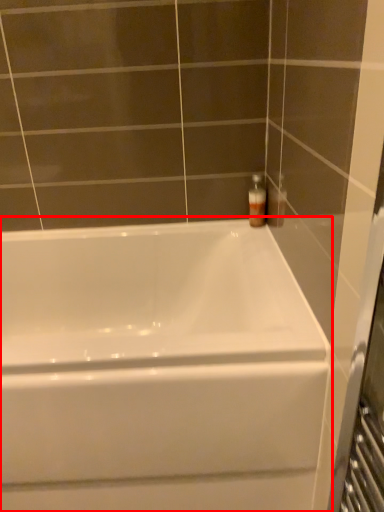
Question: From the image's perspective, where is bathtub (annotated by the red box) located in relation to soap dispenser in the image?

Choices:
 (A) above
 (B) below

Answer: (B)